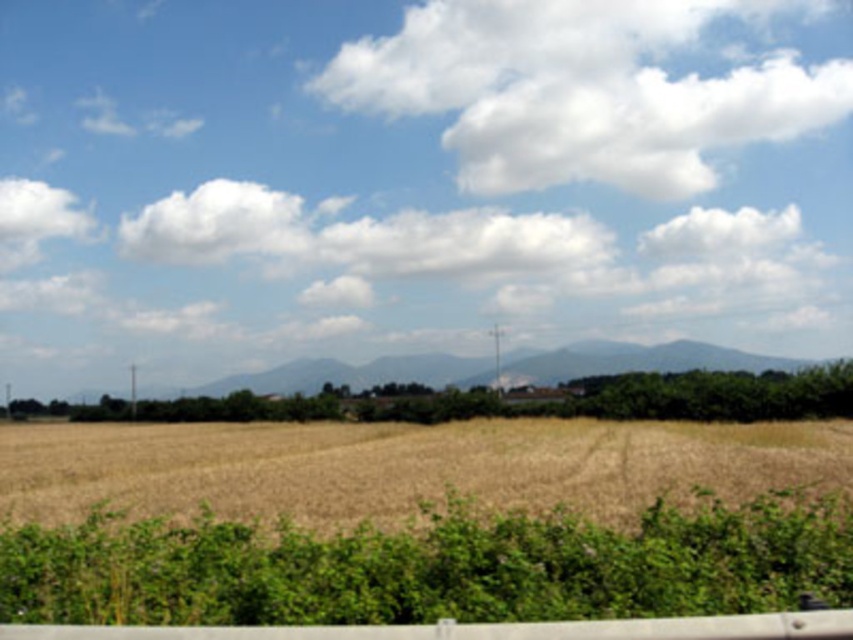
You are standing in a rural area and see the golden dry wheat field at center and the white fluffy cloud at upper center. Which object is closer to the ground?

The golden dry wheat field at center is closer to the ground because it is located below the white fluffy cloud at upper center.

You are a farmer standing at the edge of the golden dry wheat field at center and want to reach the white fluffy cloud at upper center. Can you physically walk to the cloud?

The distance between the golden dry wheat field at center and the white fluffy cloud at upper center is 84.07 meters, so yes, you can physically walk to the cloud since it is within a reasonable walking distance.